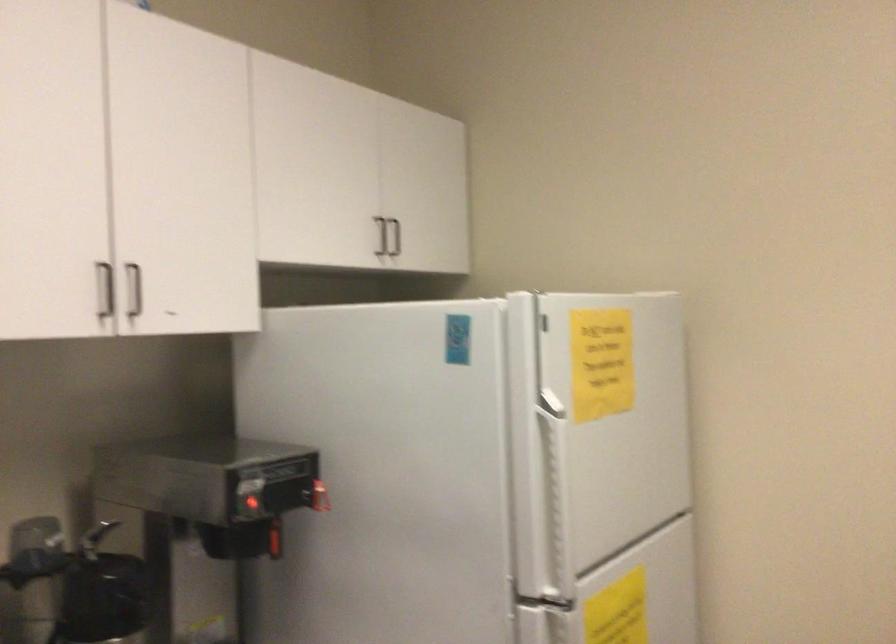
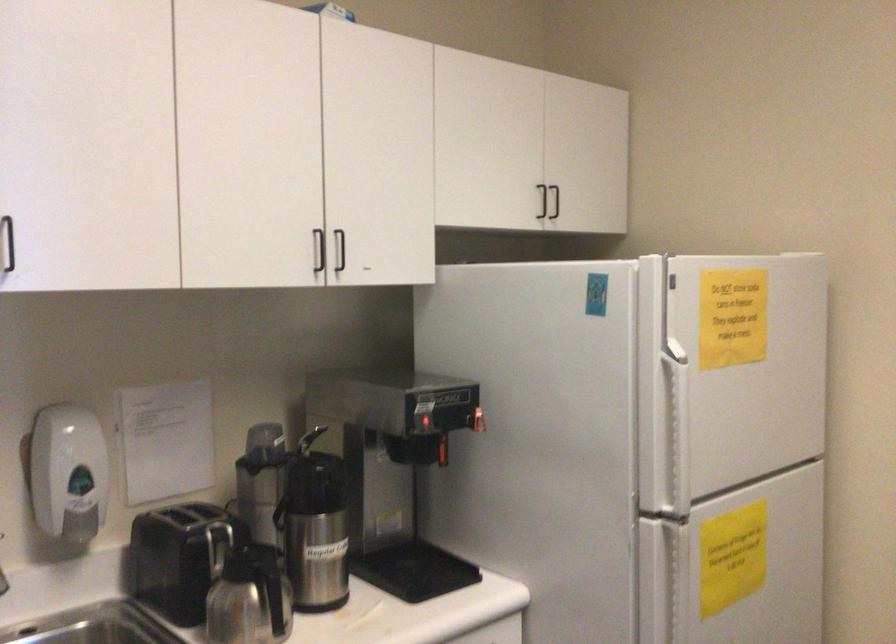
Find the pixel in the second image that matches point 140,286 in the first image.

(340, 249)